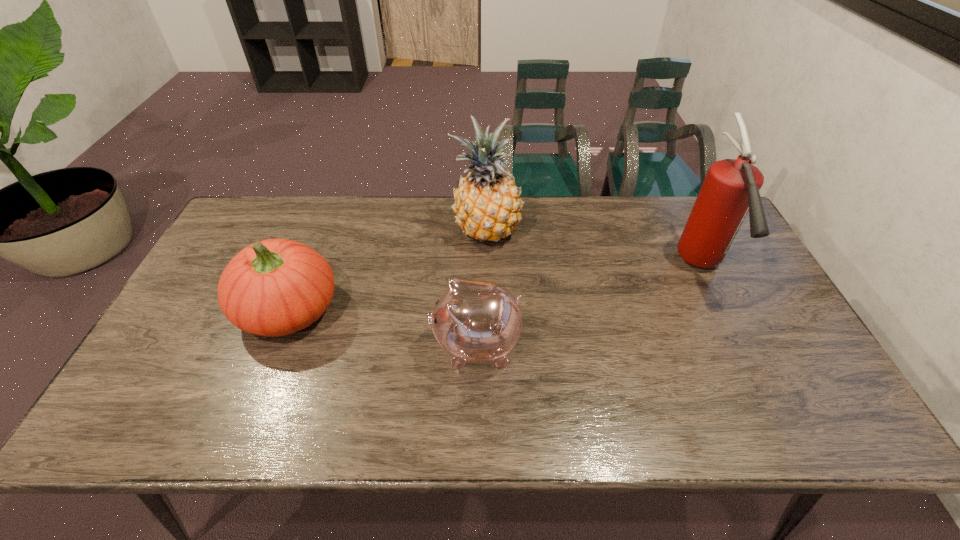
The image size is (960, 540). Identify the location of blank space that satisfies the following two spatial constraints: 1. on the front side of the pineapple; 2. on the front facing side of the piggy bank. (489, 345).

Where is `blank space that satisfies the following two spatial constraints: 1. at the nozzle of the rightmost object; 2. on the front facing side of the shortest object`? The width and height of the screenshot is (960, 540). blank space that satisfies the following two spatial constraints: 1. at the nozzle of the rightmost object; 2. on the front facing side of the shortest object is located at coordinates (740, 345).

The width and height of the screenshot is (960, 540). What are the coordinates of `free space that satisfies the following two spatial constraints: 1. on the front side of the pineapple; 2. on the front facing side of the shortest object` in the screenshot? It's located at (489, 345).

The height and width of the screenshot is (540, 960). Find the location of `free spot that satisfies the following two spatial constraints: 1. at the nozzle of the fire extinguisher; 2. on the front facing side of the shortest object`. free spot that satisfies the following two spatial constraints: 1. at the nozzle of the fire extinguisher; 2. on the front facing side of the shortest object is located at coordinates click(x=740, y=345).

Find the location of a particular element. blank area in the image that satisfies the following two spatial constraints: 1. at the nozzle of the rightmost object; 2. on the front facing side of the shortest object is located at coordinates (740, 345).